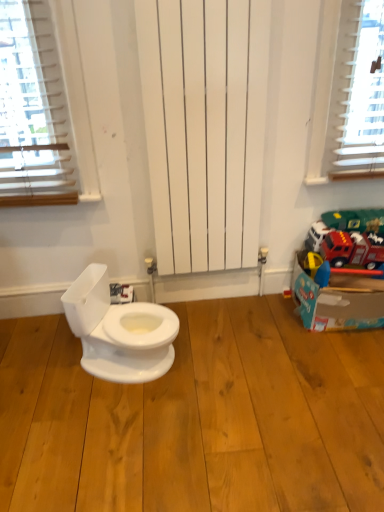
I want to click on free spot to the left of cardboard box at right, so click(258, 327).